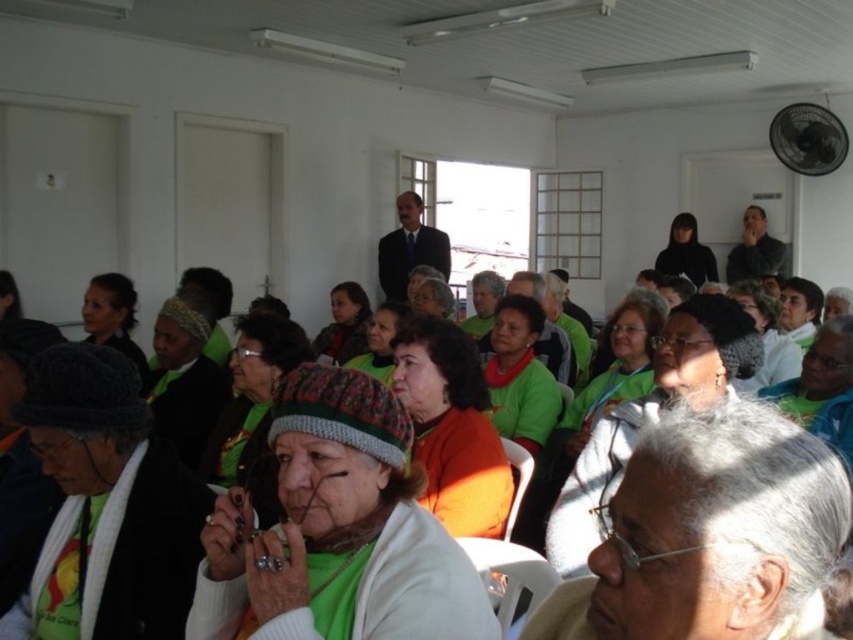
Does green knitted hat at center come behind green fabric at center?

No, it is not.

Between point (465, 614) and point (624, 484), which one is positioned in front?

Point (624, 484) is in front.

I want to click on green knitted hat at center, so click(x=337, y=531).

Is green knitted hat at center above dark suit at center?

Incorrect, green knitted hat at center is not positioned above dark suit at center.

Between green knitted hat at center and dark suit at center, which one appears on the left side from the viewer's perspective?

dark suit at center

This screenshot has height=640, width=853. What do you see at coordinates (337, 531) in the screenshot? I see `green knitted hat at center` at bounding box center [337, 531].

At what (x,y) coordinates should I click in order to perform the action: click on green knitted hat at center. Please return your answer as a coordinate pair (x, y). Looking at the image, I should click on (337, 531).

Looking at this image, between green fabric at center and dark suit at center, which one has less height?

green fabric at center

Can you confirm if green fabric at center is positioned to the left of dark suit at center?

In fact, green fabric at center is to the right of dark suit at center.

Does point (630, 444) come farther from viewer compared to point (434, 248)?

No.

Locate an element on the screen. green fabric at center is located at coordinates (676, 380).